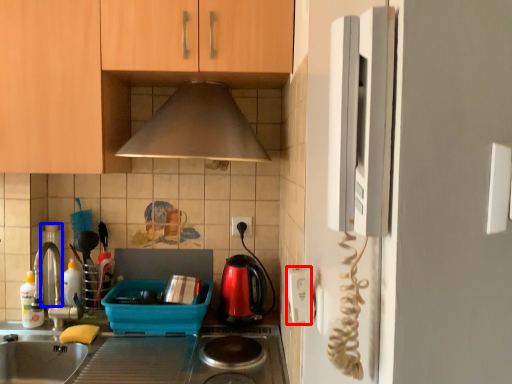
Question: Which object appears closest to the camera in this image, electric outlet (highlighted by a red box) or appliance (highlighted by a blue box)?

Choices:
 (A) electric outlet
 (B) appliance

Answer: (A)